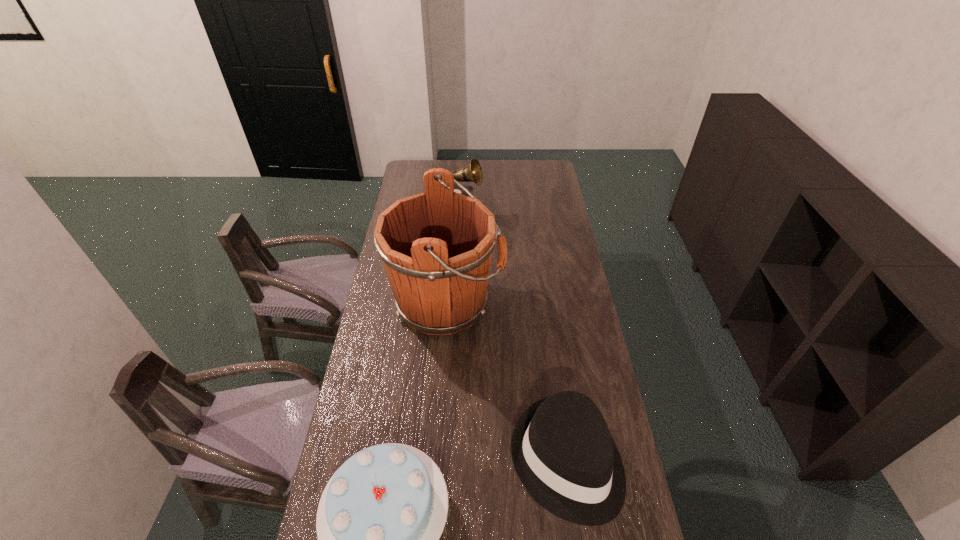
The height and width of the screenshot is (540, 960). In order to click on vacant region at the far edge in this screenshot , I will do `click(446, 162)`.

In the image, there is a desktop. At what (x,y) coordinates should I click in order to perform the action: click on vacant space at the left edge. Please return your answer as a coordinate pair (x, y). This screenshot has height=540, width=960. Looking at the image, I should click on (373, 430).

You are a GUI agent. You are given a task and a screenshot of the screen. Output one action in this format:
    pyautogui.click(x=<x>, y=<y>)
    Task: Click on the vacant space at the right edge of the desktop
    The width and height of the screenshot is (960, 540).
    Given the screenshot: What is the action you would take?
    pos(544,265)

The image size is (960, 540). What are the coordinates of `vacant point located between the fedora and the tallest object` in the screenshot? It's located at (507, 381).

The image size is (960, 540). What are the coordinates of `vacant space that is in between the fedora and the farthest object` in the screenshot? It's located at (512, 336).

Find the location of a particular element. This screenshot has width=960, height=540. vacant point located between the phonograph record and the fedora is located at coordinates (512, 336).

Locate an element on the screen. The image size is (960, 540). free space between the tallest object and the fedora is located at coordinates (507, 381).

You are a GUI agent. You are given a task and a screenshot of the screen. Output one action in this format:
    pyautogui.click(x=<x>, y=<y>)
    Task: Click on the object that is the third closest to the phonograph record
    
    Given the screenshot: What is the action you would take?
    pyautogui.click(x=379, y=520)

Locate an element on the screen. The width and height of the screenshot is (960, 540). object that ranks as the second closest to the birthday cake is located at coordinates (436, 246).

The height and width of the screenshot is (540, 960). What are the coordinates of `vacant space that satisfies the following two spatial constraints: 1. on the horn of the second tallest object; 2. on the back side of the fedora` in the screenshot? It's located at (443, 460).